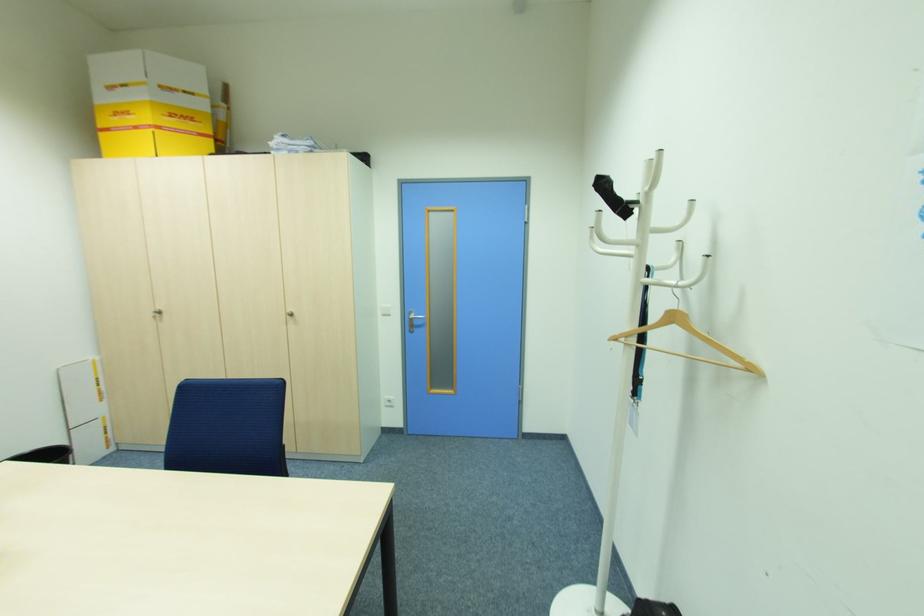
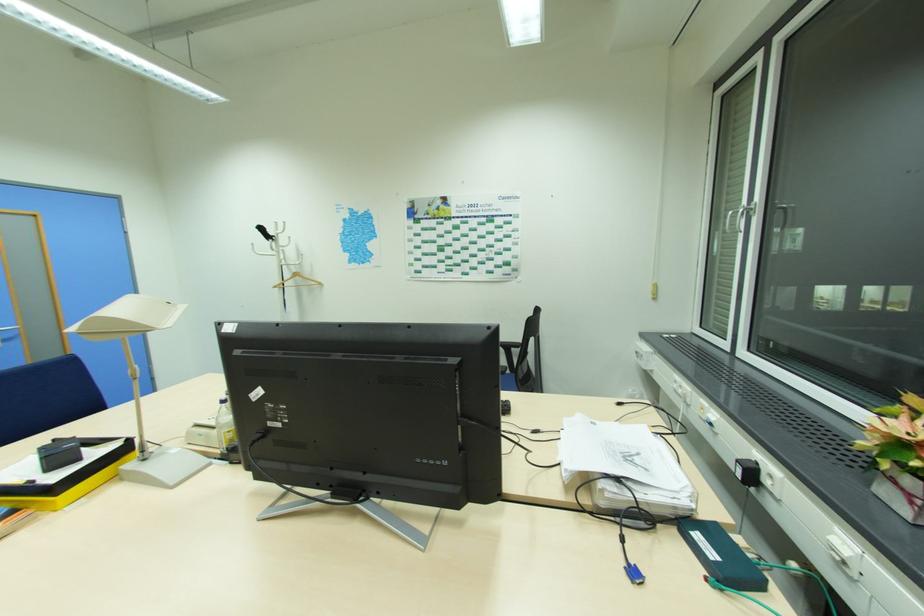
Find the pixel in the second image that matches pixel 639 201 in the first image.

(276, 237)